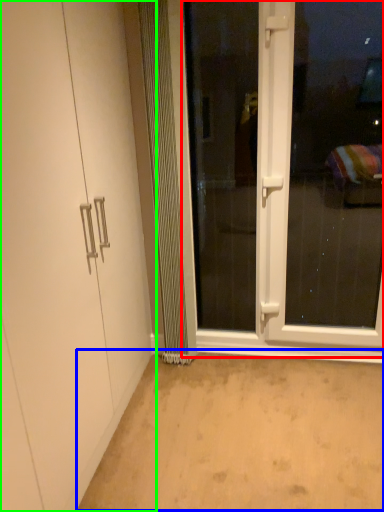
Question: Based on their relative distances, which object is farther from screen door (highlighted by a red box)? Choose from plain (highlighted by a blue box) and door (highlighted by a green box).

Choices:
 (A) plain
 (B) door

Answer: (B)